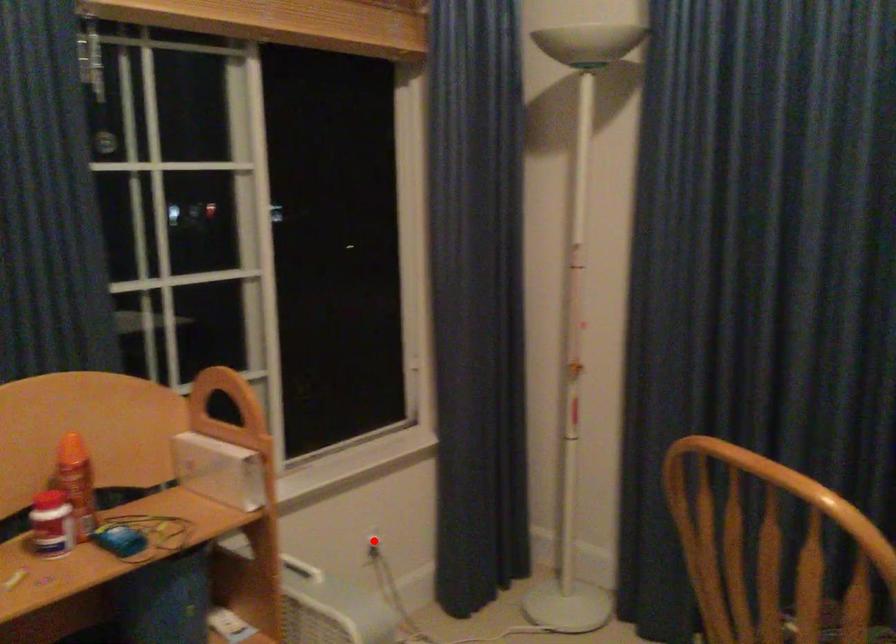
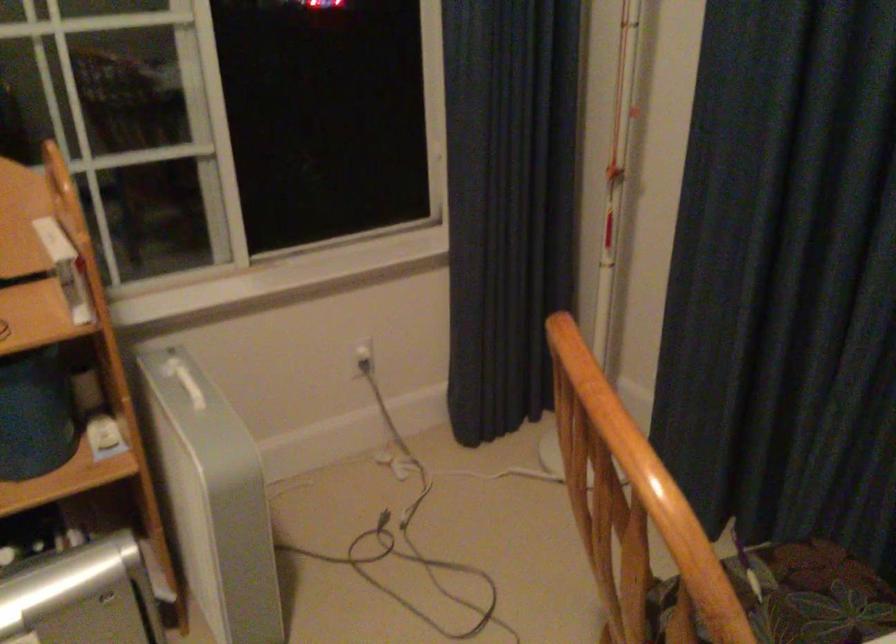
Question: I am providing you with two images of the same scene from different viewpoints. A red point is shown in image1. For the corresponding object point in image2, is it positioned nearer or farther from the camera?

Choices:
 (A) Nearer
 (B) Farther

Answer: (A)